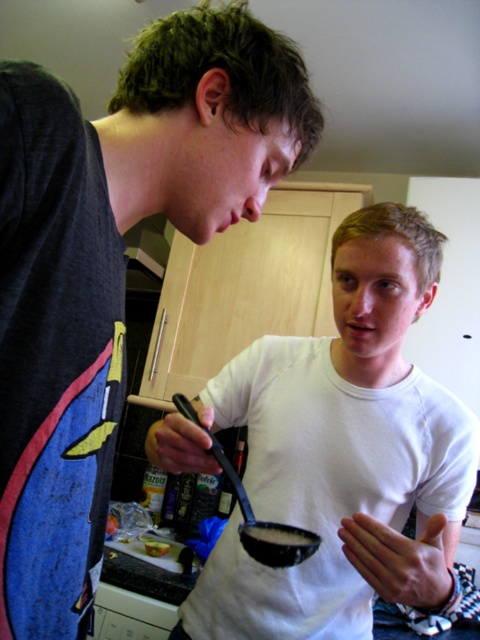
You are standing in the kitchen scene described. You need to locate the white matte shirt at center. Can you tell me its exact 2D coordinates from the image?

The white matte shirt at center is located at the 2D coordinates point (112, 266).

You are a chef preparing a dish in the kitchen. You have a white matte shirt at center and a white matte bowl at center. Which item is narrower?

The white matte shirt at center has a lesser width compared to the white matte bowl at center, so the white matte shirt at center is narrower.

You are a chef preparing a dish and need to place the white matte bowl at center and the yellowish matte bread at lower left on a shelf. The shelf has a height limit of 10 cm. Can both items fit vertically on the shelf without exceeding the height limit?

The white matte bowl at center is much taller than the yellowish matte bread at lower left. Since the shelf has a height limit of 10 cm, only the shorter item, the yellowish matte bread at lower left, can fit vertically. The white matte bowl at center may exceed the height limit and cannot be placed on the shelf vertically.